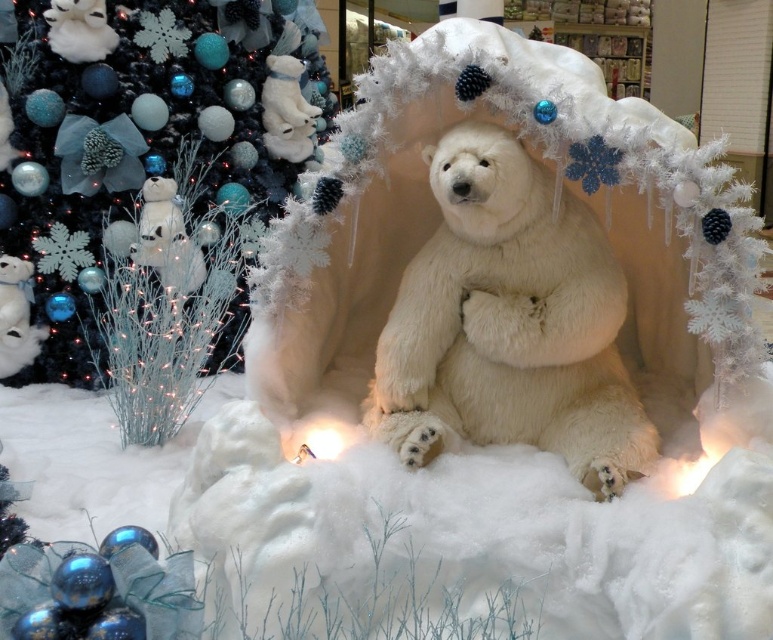
Between point (111, 125) and point (581, 452), which one is positioned behind?

The point (111, 125) is behind.

Does matte black christmas tree at upper left have a smaller size compared to white fluffy bear at center?

No.

Is point (70, 260) less distant than point (615, 305)?

That is False.

Where is `matte black christmas tree at upper left`? This screenshot has width=773, height=640. matte black christmas tree at upper left is located at coordinates (145, 138).